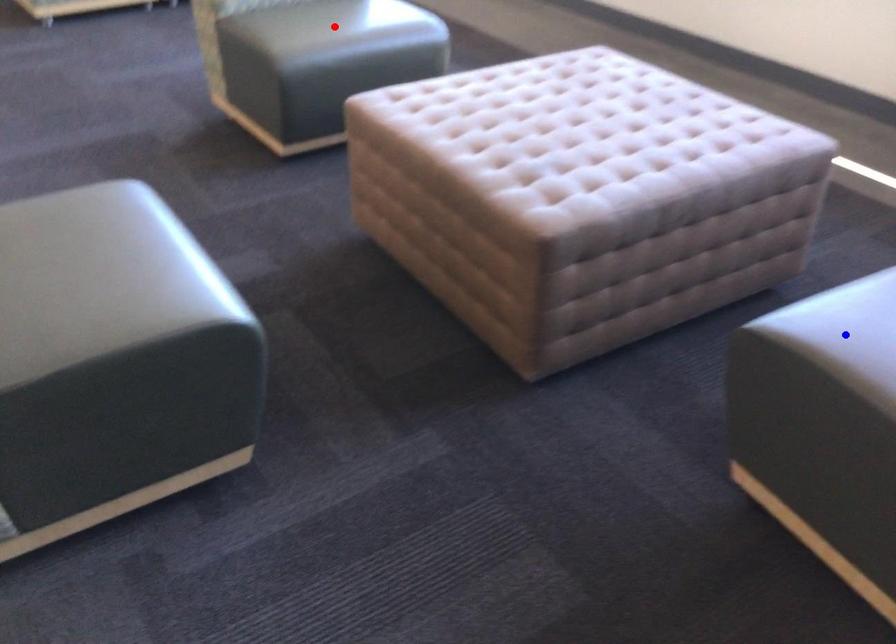
Question: Two points are marked on the image. Which point is closer to the camera?

Choices:
 (A) Blue point is closer.
 (B) Red point is closer.

Answer: (A)